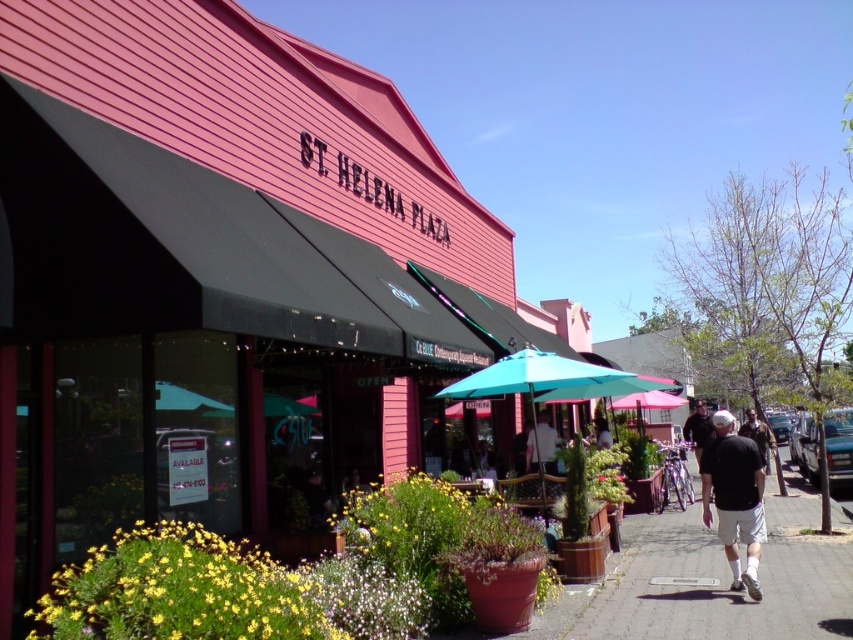
Question: Which object is closer to the camera taking this photo?

Choices:
 (A) black fabric shirt at lower right
 (B) dark gray shirt at right
 (C) matte white shirt at center

Answer: (A)

Question: Estimate the real-world distances between objects in this image. Which object is closer to the black fabric shirt at lower right?

Choices:
 (A) dark gray shirt at right
 (B) teal fabric umbrella at center

Answer: (A)

Question: Considering the relative positions of black cotton shirt at lower right and dark gray shirt at right in the image provided, where is black cotton shirt at lower right located with respect to dark gray shirt at right?

Choices:
 (A) right
 (B) left

Answer: (B)

Question: Is gray concrete sidewalk at lower right further to the viewer compared to teal fabric umbrella at center?

Choices:
 (A) yes
 (B) no

Answer: (B)

Question: Which object is the farthest from the black cotton shirt at lower right?

Choices:
 (A) teal fabric umbrella at center
 (B) dark gray shirt at right

Answer: (B)

Question: Does gray concrete sidewalk at lower right have a larger size compared to dark gray shirt at center?

Choices:
 (A) no
 (B) yes

Answer: (B)